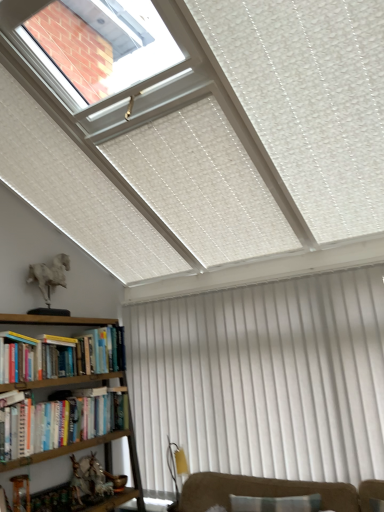
Question: From the image's perspective, is hardcover book at lower left, the 3th book positioned from the top, on top of wooden bookshelf at lower left?

Choices:
 (A) yes
 (B) no

Answer: (B)

Question: From a real-world perspective, is hardcover book at lower left, the 3th book positioned from the top, located higher than wooden bookshelf at lower left?

Choices:
 (A) yes
 (B) no

Answer: (A)

Question: Is hardcover book at lower left, the 3th book positioned from the top, to the left of wooden bookshelf at lower left from the viewer's perspective?

Choices:
 (A) no
 (B) yes

Answer: (A)

Question: Considering the relative sizes of hardcover book at lower left, the 3th book positioned from the top, and wooden bookshelf at lower left in the image provided, is hardcover book at lower left, the 3th book positioned from the top, taller than wooden bookshelf at lower left?

Choices:
 (A) yes
 (B) no

Answer: (B)

Question: Is there a large distance between hardcover book at lower left, the 3th book positioned from the top, and wooden bookshelf at lower left?

Choices:
 (A) yes
 (B) no

Answer: (B)

Question: Would you say wooden bookshelf at lower left is part of hardcover book at lower left, the 3th book positioned from the top,'s contents?

Choices:
 (A) no
 (B) yes

Answer: (A)

Question: From the image's perspective, is hardcover book at lower left, the 3th book positioned from the top, above hardcover book at left, the second book in the top-to-bottom sequence?

Choices:
 (A) yes
 (B) no

Answer: (B)

Question: Is hardcover book at lower left, the 3th book positioned from the top, positioned beyond the bounds of hardcover book at left, the second book in the top-to-bottom sequence?

Choices:
 (A) yes
 (B) no

Answer: (A)

Question: Can you confirm if hardcover book at lower left, the 3th book positioned from the top, is bigger than hardcover book at left, positioned as the second book in bottom-to-top order?

Choices:
 (A) no
 (B) yes

Answer: (B)

Question: From the image's perspective, does hardcover book at lower left, the 3th book positioned from the top, appear lower than hardcover book at left, positioned as the second book in bottom-to-top order?

Choices:
 (A) yes
 (B) no

Answer: (A)

Question: Is hardcover book at lower left, the 3th book positioned from the top, taller than hardcover book at left, the second book in the top-to-bottom sequence?

Choices:
 (A) no
 (B) yes

Answer: (A)

Question: From a real-world perspective, is hardcover book at lower left, the 3th book positioned from the top, beneath hardcover book at left, the second book in the top-to-bottom sequence?

Choices:
 (A) yes
 (B) no

Answer: (A)

Question: From the image's perspective, is white textured curtain at lower right over hardcover book at left, which ranks as the 1th book in top-to-bottom order?

Choices:
 (A) yes
 (B) no

Answer: (B)